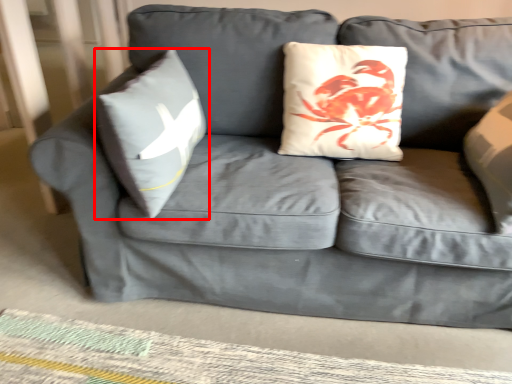
Question: From the image, what is the correct spatial relationship of pillow (annotated by the red box) in relation to mat?

Choices:
 (A) left
 (B) right

Answer: (A)